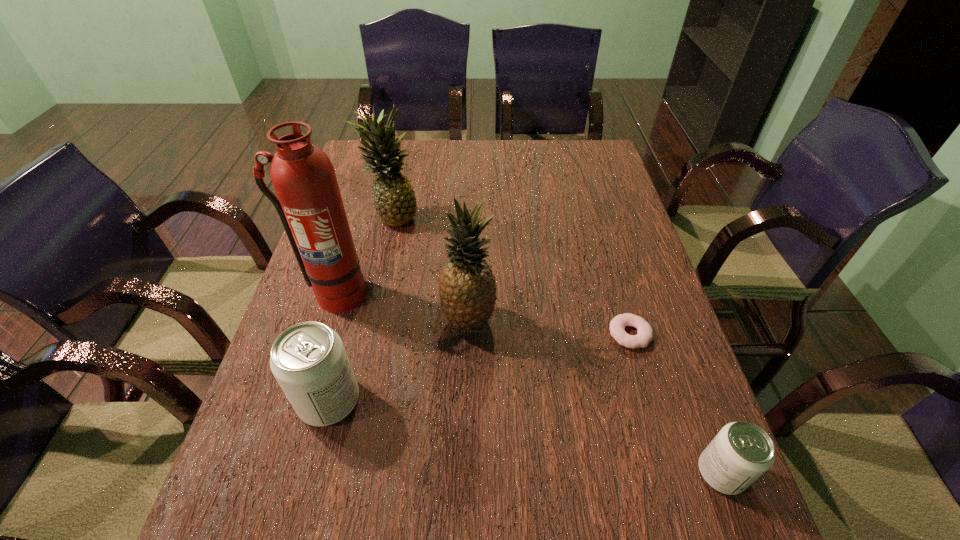
Locate an element on the screen. fire extinguisher positioned at the left edge is located at coordinates (309, 204).

Identify the location of soda can present at the right edge. (741, 452).

At what (x,y) coordinates should I click in order to perform the action: click on doughnut that is positioned at the right edge. Please return your answer as a coordinate pair (x, y). Looking at the image, I should click on (644, 335).

Where is `object that is at the near right corner`? This screenshot has height=540, width=960. object that is at the near right corner is located at coordinates (741, 452).

Where is `vacant space at the far edge of the desktop`? This screenshot has height=540, width=960. vacant space at the far edge of the desktop is located at coordinates (484, 148).

Locate an element on the screen. The width and height of the screenshot is (960, 540). free space at the near edge is located at coordinates (470, 449).

Find the location of `free space at the left edge`. free space at the left edge is located at coordinates pos(365,227).

In the image, there is a desktop. Identify the location of vacant space at the far left corner. (357, 159).

In the image, there is a desktop. At what (x,y) coordinates should I click in order to perform the action: click on vacant region at the far right corner. Please return your answer as a coordinate pair (x, y). Looking at the image, I should click on (586, 157).

I want to click on unoccupied position between the shortest object and the third object from right to left, so click(549, 327).